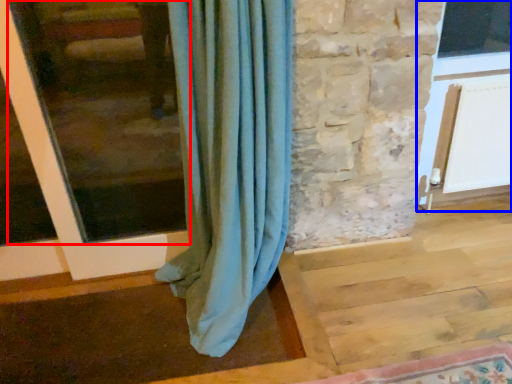
Question: Which point is further to the camera, window frame (highlighted by a red box) or screen door (highlighted by a blue box)?

Choices:
 (A) window frame
 (B) screen door

Answer: (B)